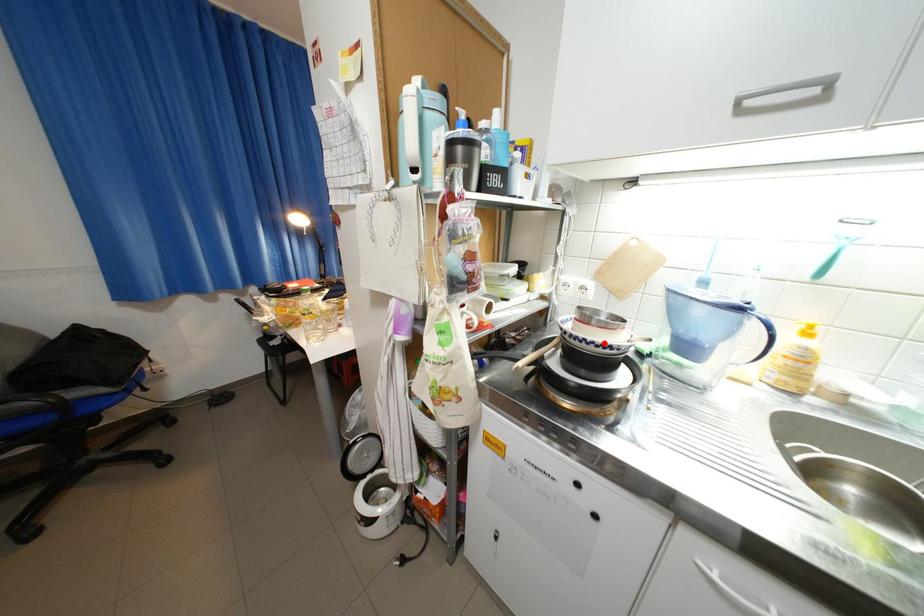
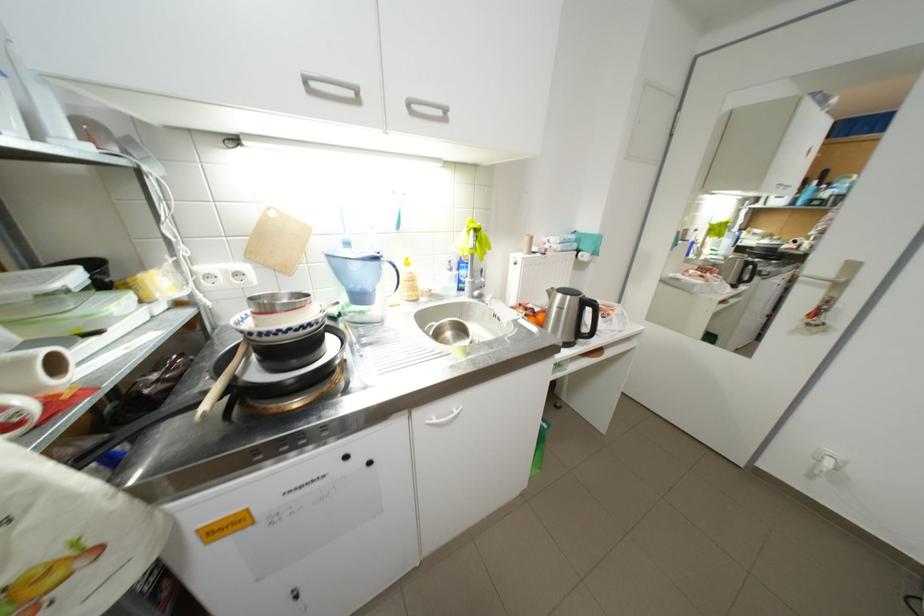
Question: A red point is marked in image1. In image2, is the corresponding 3D point closer to the camera or farther? Reply with the corresponding letter.

Choices:
 (A) The corresponding 3D point is closer.
 (B) The corresponding 3D point is farther.

Answer: (A)